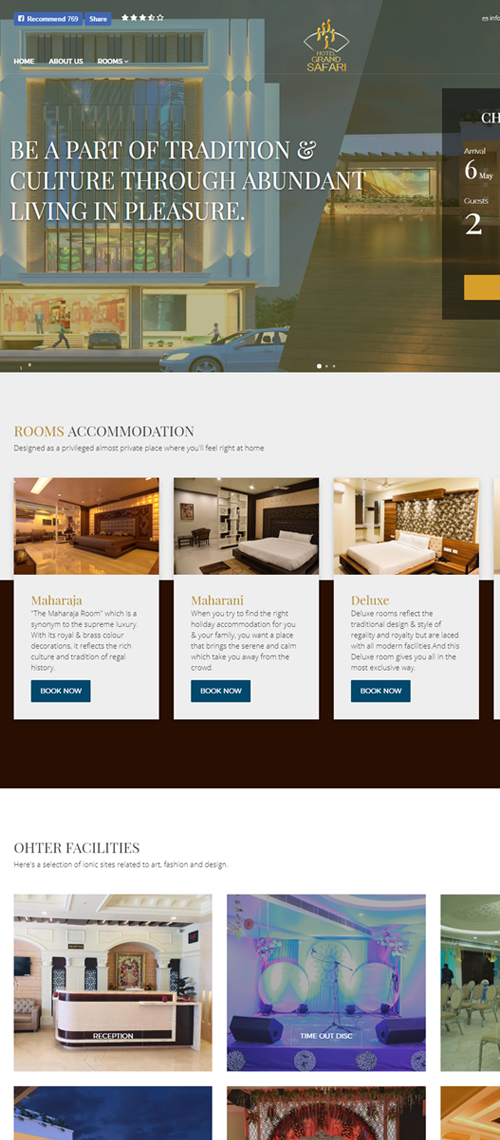
The height and width of the screenshot is (1140, 500). I want to click on sofa, so click(20, 1015).